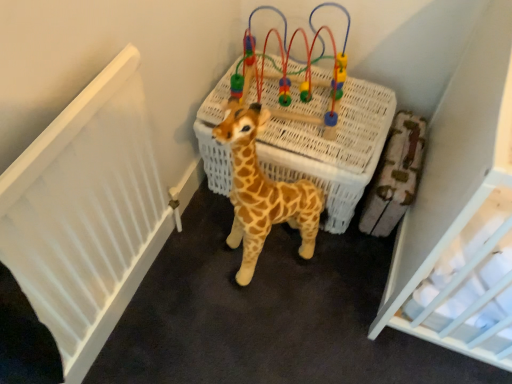
Find the location of a particular element. spots to the right of wooden bead maze at center is located at coordinates (357, 117).